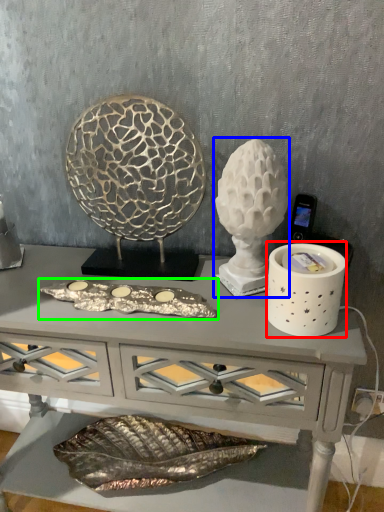
Question: Which is nearer to the candle holder (highlighted by a red box)? sculpture (highlighted by a blue box) or art (highlighted by a green box).

Choices:
 (A) sculpture
 (B) art

Answer: (A)